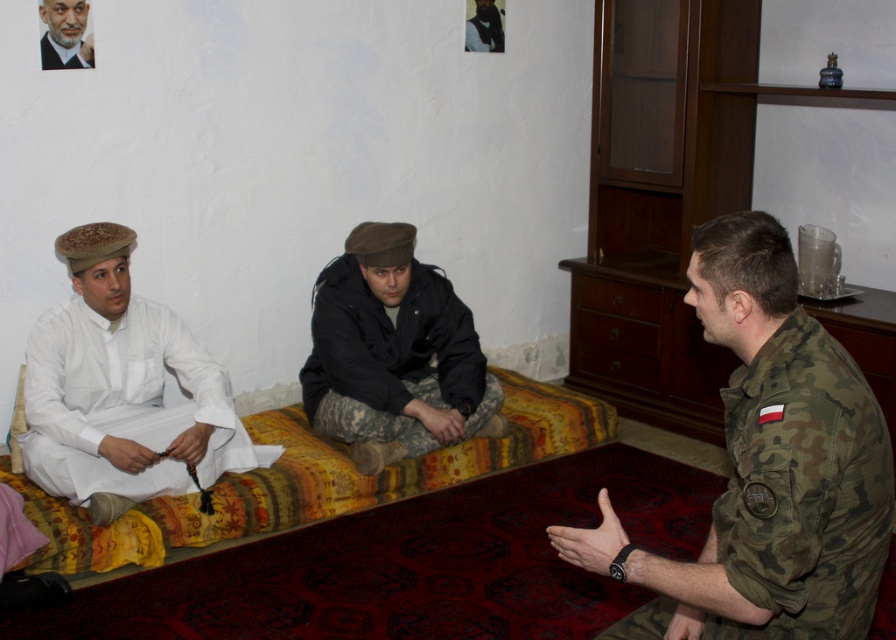
You are a delivery person who needs to place a 6.5 feet long package between the camouflage fabric uniform at right and the carpeted couch at center. Is there enough space to place it without bending the package?

The camouflage fabric uniform at right is 6.66 feet from the carpeted couch at center, so yes, the 6.5 feet long package can be placed between them without bending since the distance is slightly longer than the package.

You are standing in the room and want to move from the point at coordinates point [451,320] to the point at coordinates point [76,24]. Which direction should you move to get closer to your destination?

You should move forward because point [451,320] is further to the viewer than point [76,24], so moving forward will bring you closer to the destination.

You are standing in the room and want to hand a book to the person wearing the white cotton shirt at left. Which direction should you walk to reach them?

The white cotton shirt at left is located at point 0.611 on the x axis and 0.137 on the y axis. Since the shirt is at the left side of the room, you should walk towards the left to reach the person wearing it.